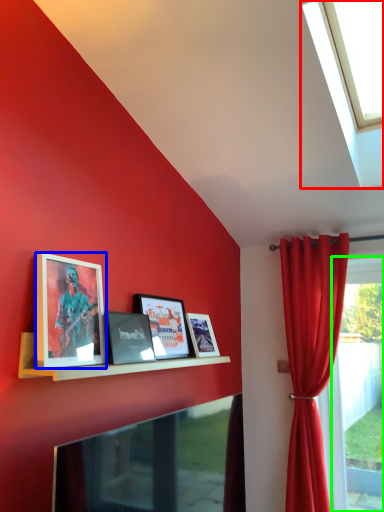
Question: Considering the real-world distances, which object is farthest from window (highlighted by a red box)? picture frame (highlighted by a blue box) or window frame (highlighted by a green box)?

Choices:
 (A) picture frame
 (B) window frame

Answer: (B)